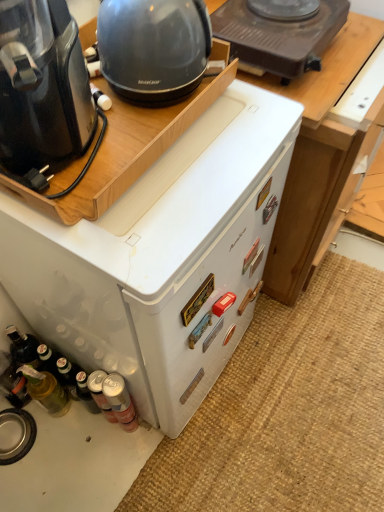
The height and width of the screenshot is (512, 384). Find the location of `vacant area in front of translucent glass bottle at lower left, which is the third bottle in right-to-left order`. vacant area in front of translucent glass bottle at lower left, which is the third bottle in right-to-left order is located at coordinates (58, 464).